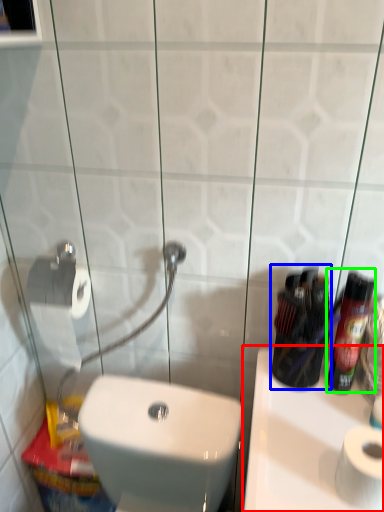
Question: Which object is positioned closest to sink (highlighted by a red box)? Select from mouthwash (highlighted by a blue box) and cleaning product (highlighted by a green box).

Choices:
 (A) mouthwash
 (B) cleaning product

Answer: (A)